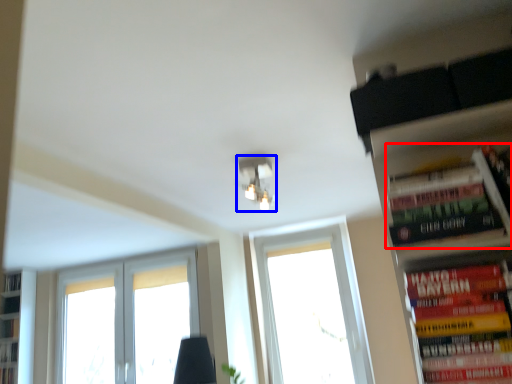
Question: Which point is closer to the camera, book (highlighted by a red box) or light fixture (highlighted by a blue box)?

Choices:
 (A) book
 (B) light fixture

Answer: (A)